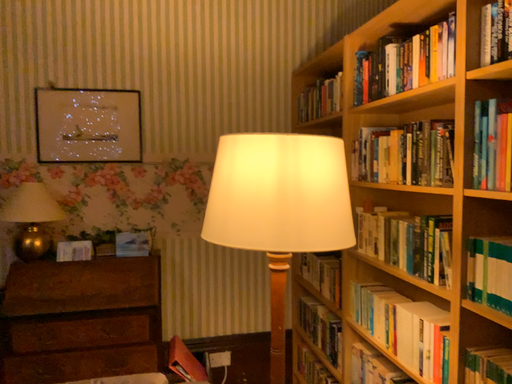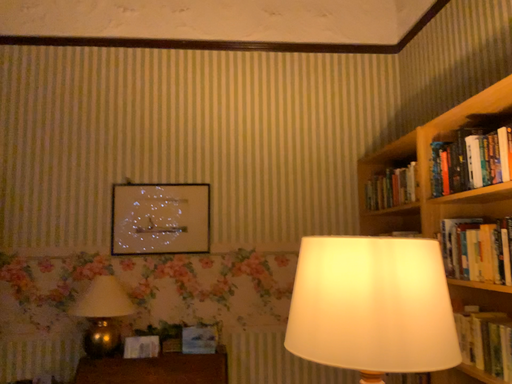
Question: Which way did the camera rotate in the video?

Choices:
 (A) rotated left
 (B) rotated right

Answer: (A)